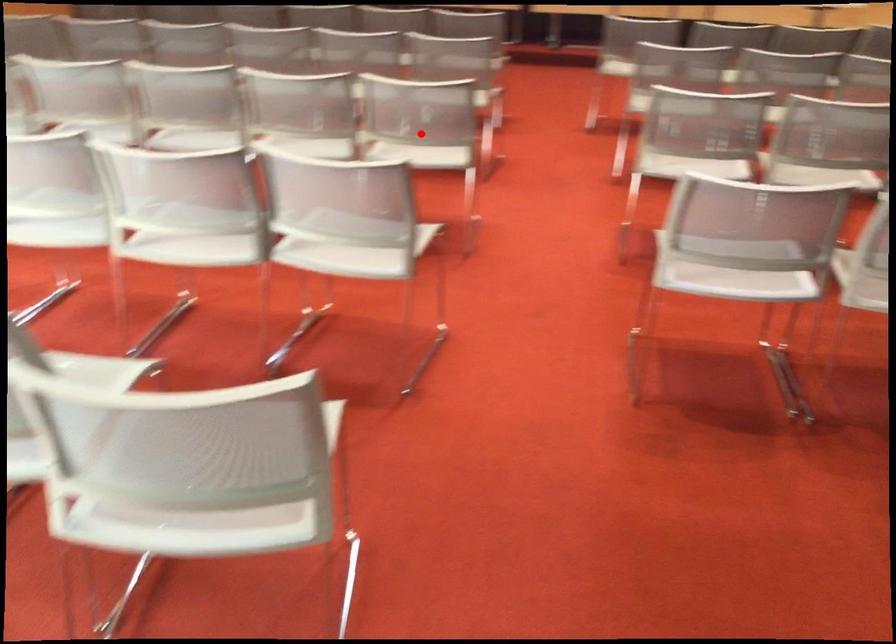
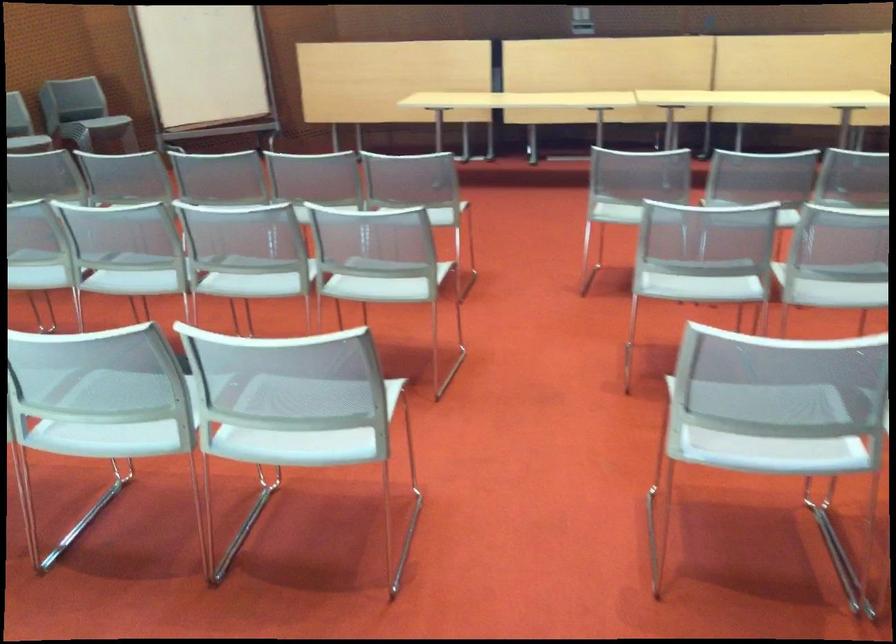
Question: A red point is marked in image1. In image2, is the corresponding 3D point closer to the camera or farther? Reply with the corresponding letter.

Choices:
 (A) The corresponding 3D point is closer.
 (B) The corresponding 3D point is farther.

Answer: (A)